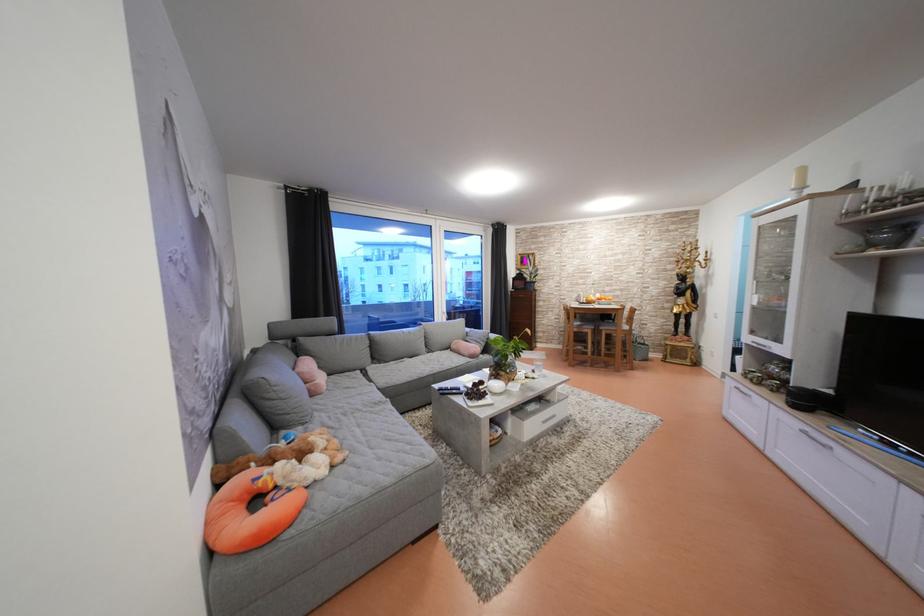
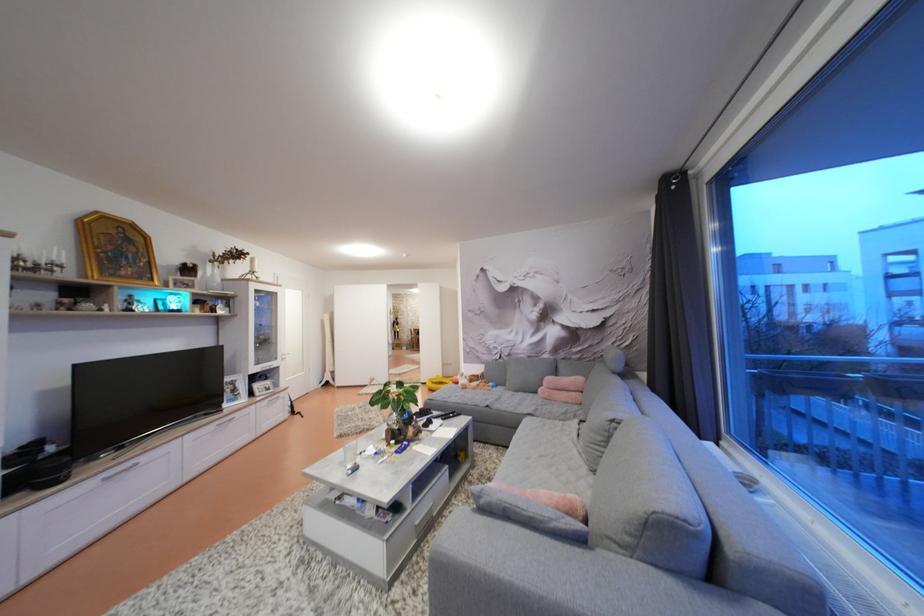
Locate, in the second image, the point that corresponds to [837,438] in the first image.

(126, 466)